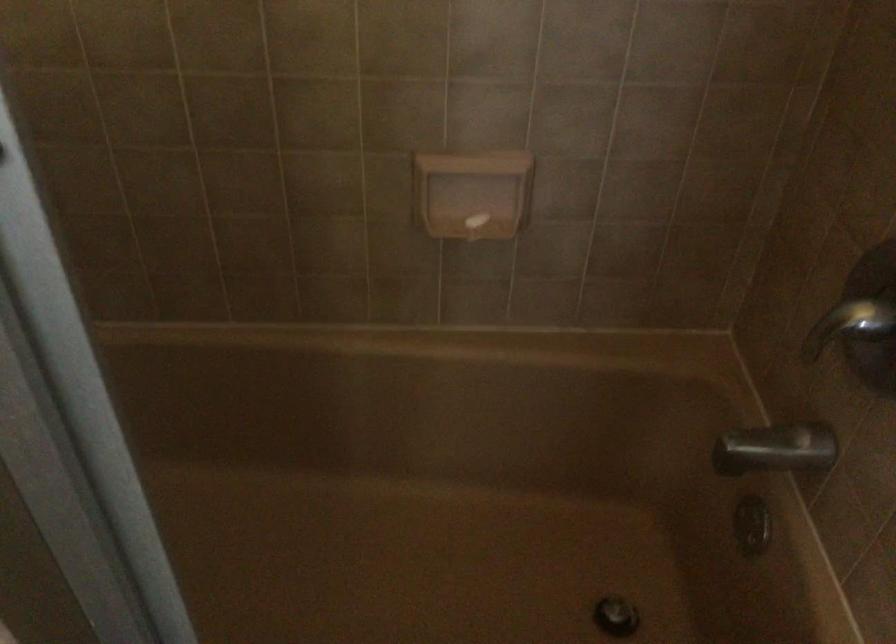
At what (x,y) coordinates should I click in order to perform the action: click on white bar of soap. Please return your answer as a coordinate pair (x, y). The width and height of the screenshot is (896, 644). Looking at the image, I should click on (476, 221).